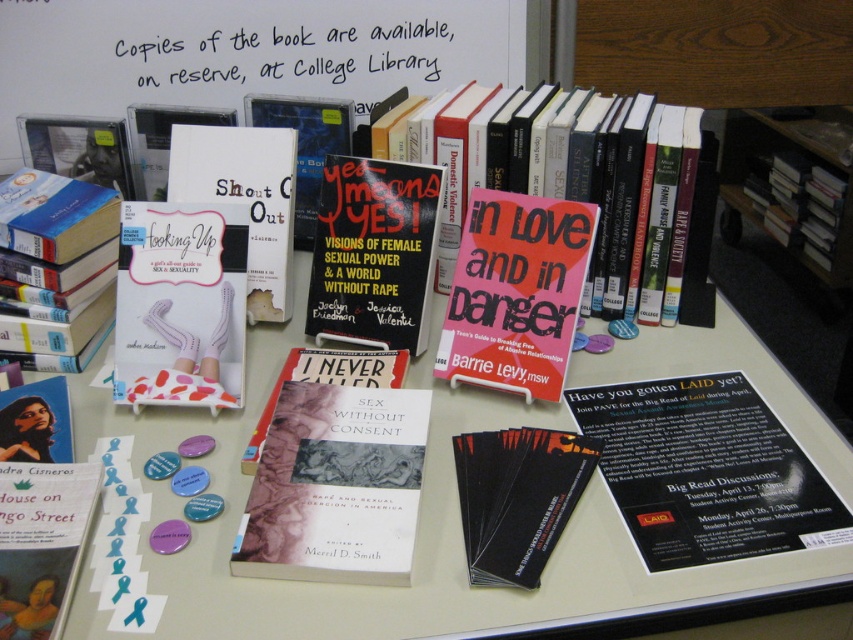
Can you confirm if black paper poster at lower right is thinner than white paper at upper center?

Yes, black paper poster at lower right is thinner than white paper at upper center.

Which is below, black paper poster at lower right or white paper at upper center?

black paper poster at lower right is lower down.

Is point (718, 404) farther from camera compared to point (141, 33)?

No, it is in front of (141, 33).

At what (x,y) coordinates should I click in order to perform the action: click on black paper poster at lower right. Please return your answer as a coordinate pair (x, y). Looking at the image, I should click on (706, 472).

Who is positioned more to the left, matte pink cover at center or black matte bookshelf at upper right?

matte pink cover at center

Is matte pink cover at center to the left of black matte bookshelf at upper right from the viewer's perspective?

Indeed, matte pink cover at center is positioned on the left side of black matte bookshelf at upper right.

Is point (494, 336) positioned behind point (733, 177)?

No, (494, 336) is in front of (733, 177).

Identify the location of matte pink cover at center. (515, 292).

Can you confirm if matte gray book at center is positioned below white dotted fabric at center?

Indeed, matte gray book at center is positioned under white dotted fabric at center.

Is matte gray book at center above white dotted fabric at center?

No.

The image size is (853, 640). In order to click on matte gray book at center in this screenshot , I will do `click(335, 486)`.